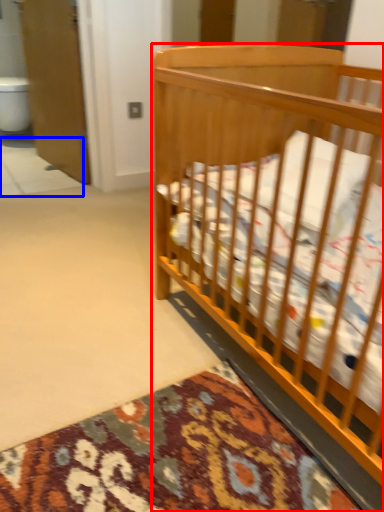
Question: Which point is further to the camera, infant bed (highlighted by a red box) or tile (highlighted by a blue box)?

Choices:
 (A) infant bed
 (B) tile

Answer: (B)